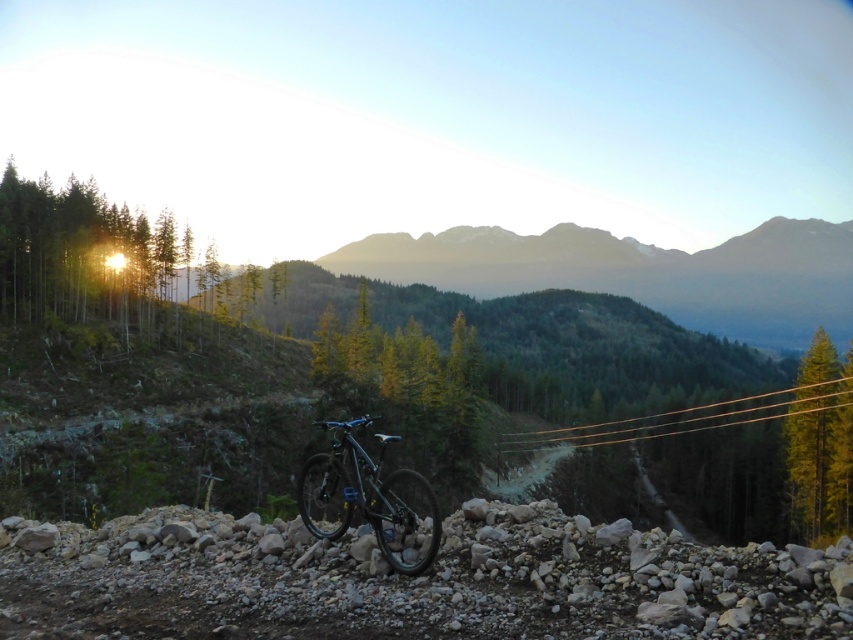
In the scene shown: You are a photographer standing at the camera position aiming to capture both the mountain bike and the dense forest in your shot. Which of the two points, point (326,529) or point (811,342), is closer to your current position?

Point (326,529) is closer to the camera than point (811,342).